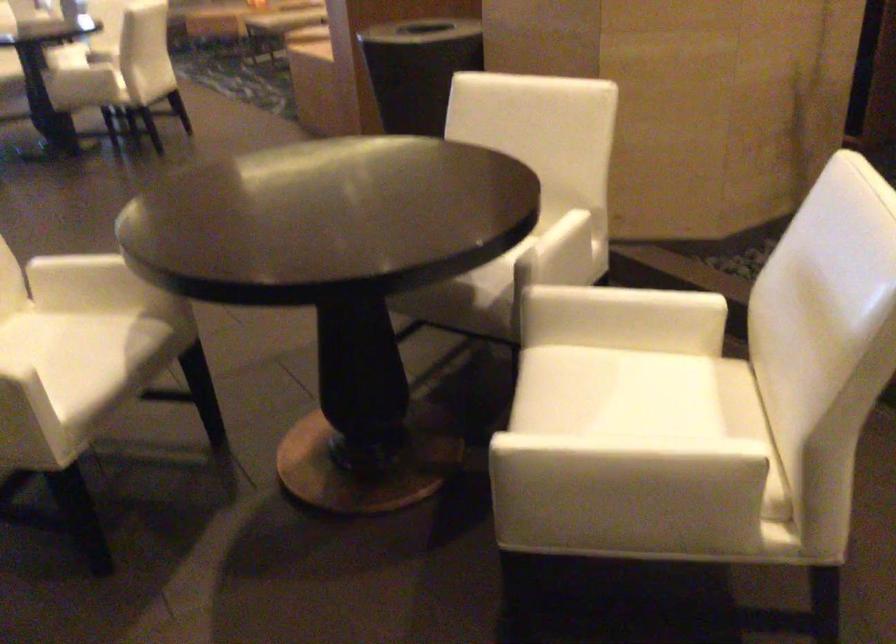
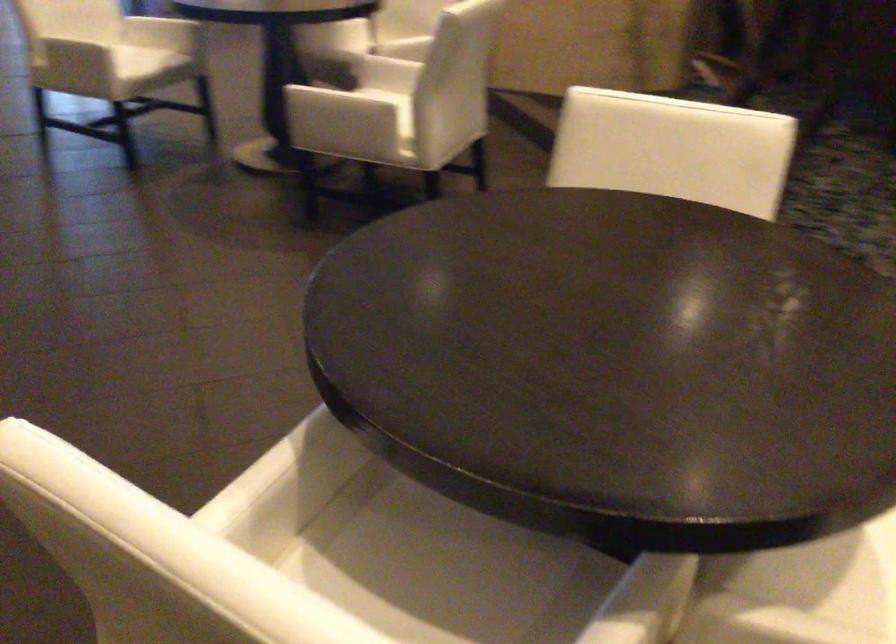
In a continuous first-person perspective shot, in which direction is the camera moving?

The cameraman moved toward right, backward.